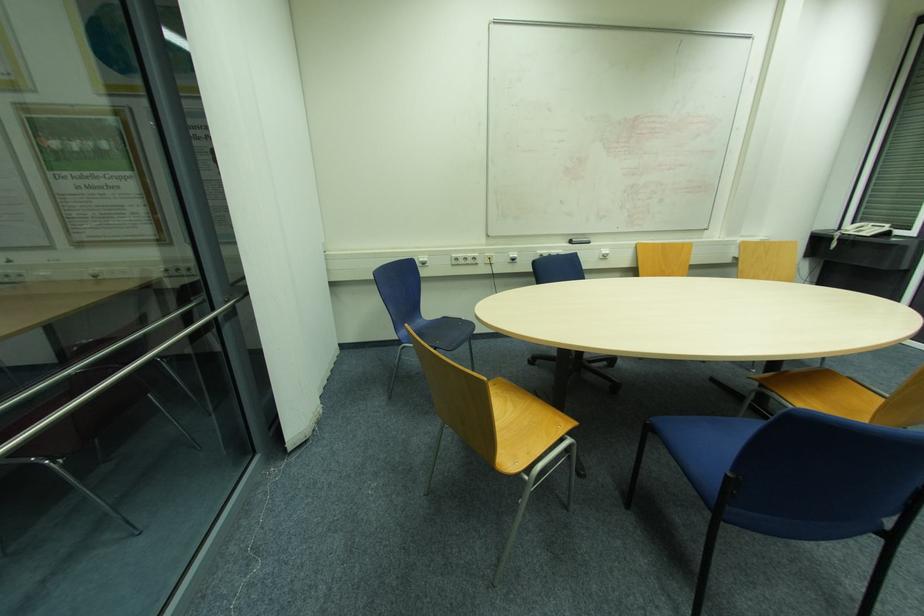
I want to click on metal handrail, so click(110, 382).